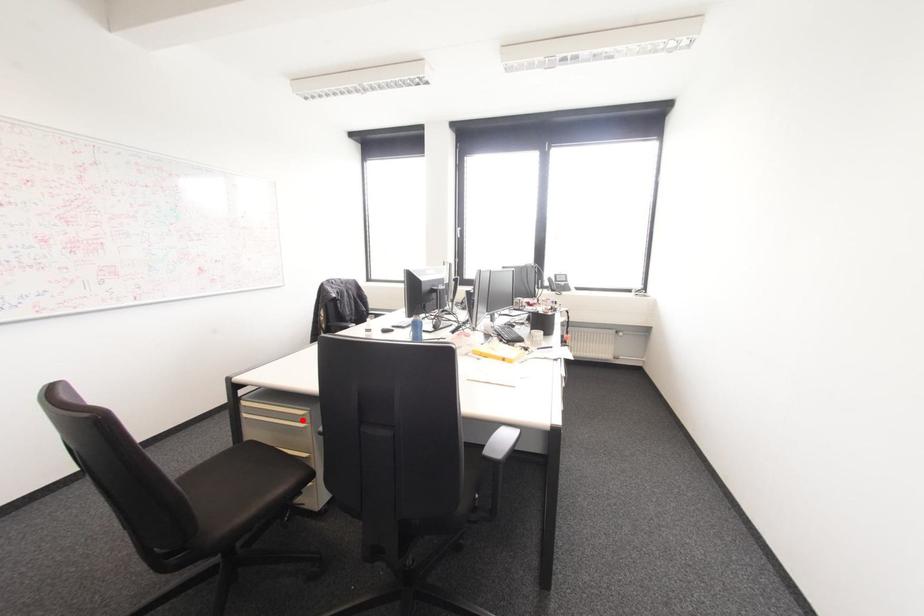
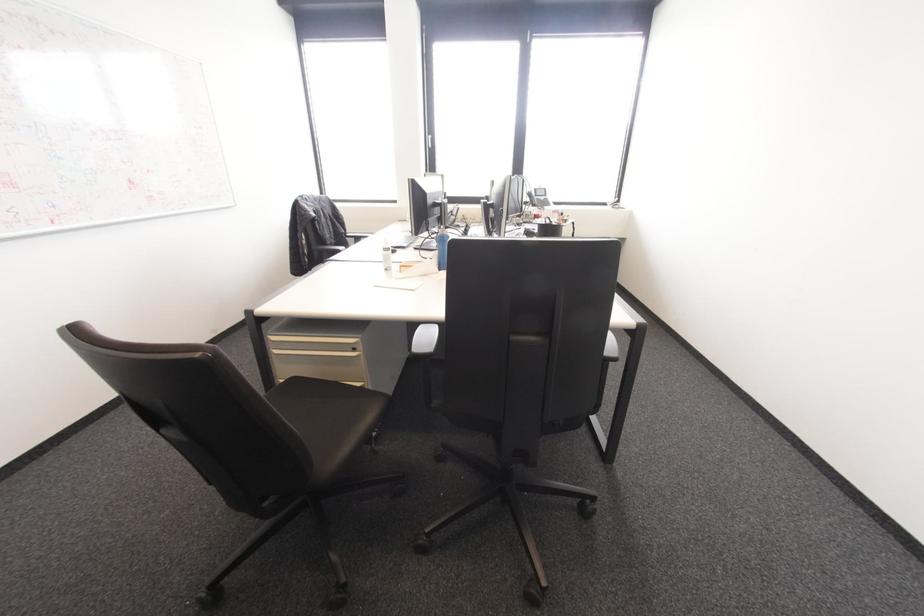
Question: I am providing you with two images of the same scene from different viewpoints. Given a red point in image1, look at the same physical point in image2. Is it:

Choices:
 (A) Closer to the viewpoint
 (B) Farther from the viewpoint

Answer: (A)